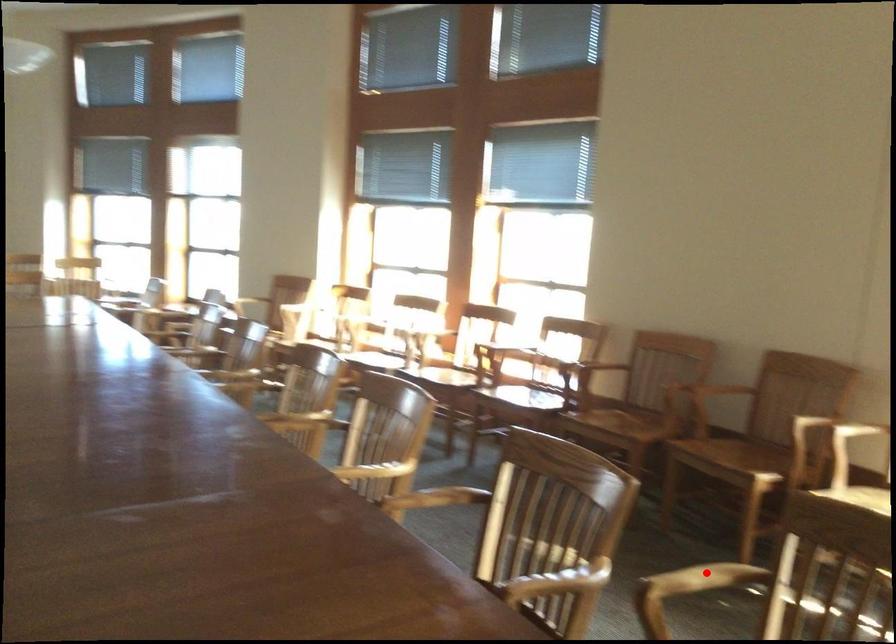
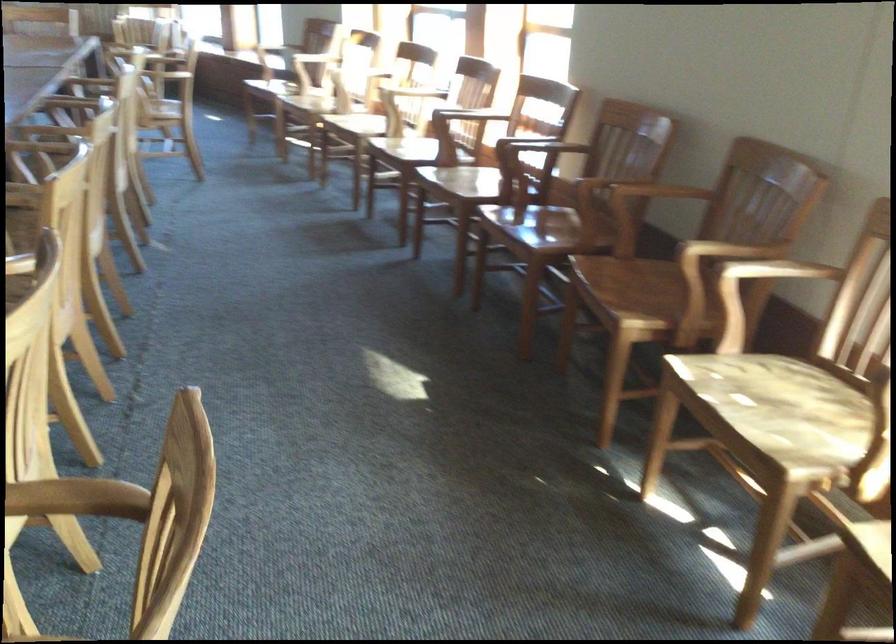
Locate, in the second image, the point that corresponds to the highlighted location in the first image.

(76, 498)